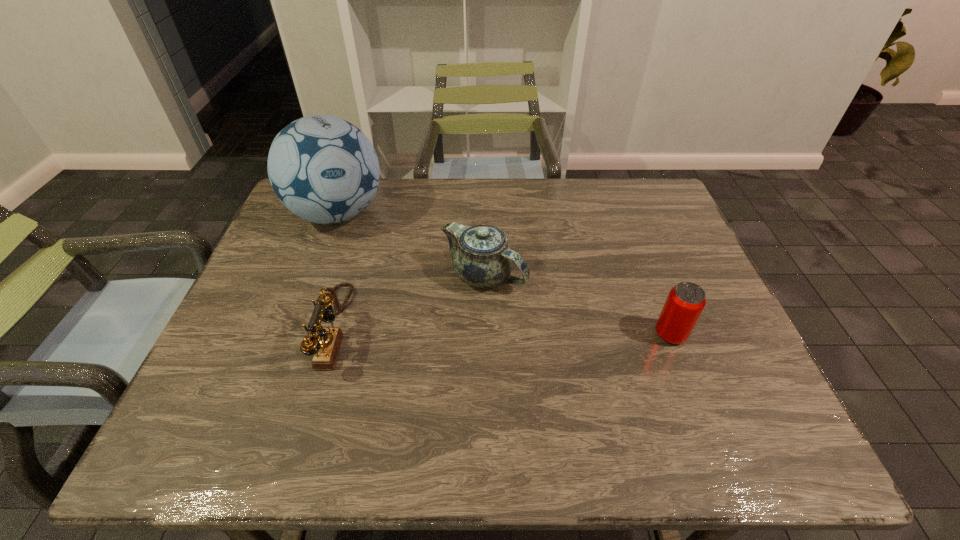
Image resolution: width=960 pixels, height=540 pixels. In order to click on vacant point located between the farthest object and the third object from left to right in this screenshot , I will do `click(411, 245)`.

Locate an element on the screen. This screenshot has width=960, height=540. empty space between the can and the second object from right to left is located at coordinates (577, 305).

Select which object appears as the third closest to the farthest object. Please provide its 2D coordinates. Your answer should be formatted as a tuple, i.e. [(x, y)], where the tuple contains the x and y coordinates of a point satisfying the conditions above.

[(685, 302)]

At what (x,y) coordinates should I click in order to perform the action: click on object that is the second closest one to the rightmost object. Please return your answer as a coordinate pair (x, y). This screenshot has width=960, height=540. Looking at the image, I should click on (325, 347).

Image resolution: width=960 pixels, height=540 pixels. What are the coordinates of `vacant space that satisfies the following two spatial constraints: 1. on the front side of the farthest object; 2. on the front-facing side of the telephone` in the screenshot? It's located at (295, 329).

This screenshot has width=960, height=540. Identify the location of free spot that satisfies the following two spatial constraints: 1. on the front side of the soccer ball; 2. on the left side of the third object from left to right. (314, 276).